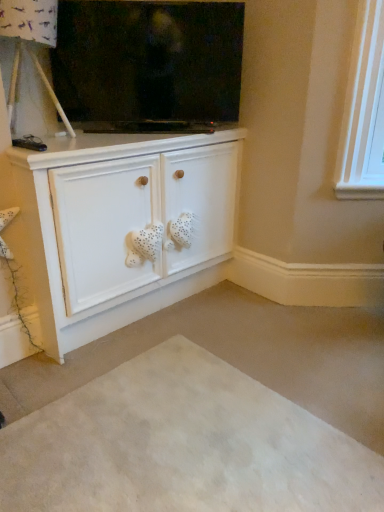
I want to click on flat screen tv at upper center, so click(148, 60).

This screenshot has width=384, height=512. In order to click on beige carpet at lower center in this screenshot , I will do `click(182, 445)`.

Which object is more forward, flat screen tv at upper center or beige carpet at lower center?

beige carpet at lower center is more forward.

Measure the distance between flat screen tv at upper center and beige carpet at lower center.

flat screen tv at upper center is 1.54 meters away from beige carpet at lower center.

Looking at this image, does flat screen tv at upper center have a lesser height compared to beige carpet at lower center?

A: Incorrect, the height of flat screen tv at upper center does not fall short of that of beige carpet at lower center.

In the scene shown: From the image's perspective, would you say flat screen tv at upper center is shown under beige carpet at lower center?

Actually, flat screen tv at upper center appears above beige carpet at lower center in the image.

Can you confirm if flat screen tv at upper center is wider than white matte cabinet at center?

In fact, flat screen tv at upper center might be narrower than white matte cabinet at center.

From the image's perspective, who appears lower, flat screen tv at upper center or white matte cabinet at center?

white matte cabinet at center.

Is flat screen tv at upper center positioned far away from white matte cabinet at center?

No.

From a real-world perspective, who is located lower, white matte cabinet at center or flat screen tv at upper center?

white matte cabinet at center.

Does white matte cabinet at center have a lesser width compared to flat screen tv at upper center?

No, white matte cabinet at center is not thinner than flat screen tv at upper center.

Is white matte cabinet at center oriented towards flat screen tv at upper center?

No, white matte cabinet at center is not facing towards flat screen tv at upper center.

Considering their positions, is white matte cabinet at center located in front of or behind flat screen tv at upper center?

Visually, white matte cabinet at center is located in front of flat screen tv at upper center.

Can we say beige carpet at lower center lies outside white matte cabinet at center?

Indeed, beige carpet at lower center is completely outside white matte cabinet at center.

Considering the relative positions of beige carpet at lower center and white matte cabinet at center in the image provided, is beige carpet at lower center to the left of white matte cabinet at center from the viewer's perspective?

No, beige carpet at lower center is not to the left of white matte cabinet at center.

Are beige carpet at lower center and white matte cabinet at center far apart?

No.

How different are the orientations of beige carpet at lower center and white matte cabinet at center in degrees?

The angular difference between beige carpet at lower center and white matte cabinet at center is 90.7 degrees.

Considering the relative positions of white matte cabinet at center and beige carpet at lower center in the image provided, is white matte cabinet at center to the left or to the right of beige carpet at lower center?

white matte cabinet at center is positioned on beige carpet at lower center's left side.

The width and height of the screenshot is (384, 512). Find the location of `plain lying on the right of white matte cabinet at center`. plain lying on the right of white matte cabinet at center is located at coordinates (182, 445).

Does white matte cabinet at center lie in front of beige carpet at lower center?

No, it is not.

From a real-world perspective, is white matte cabinet at center below beige carpet at lower center?

No, from a real-world perspective, white matte cabinet at center is not under beige carpet at lower center.

Would you say beige carpet at lower center is a long distance from flat screen tv at upper center?

Yes, beige carpet at lower center and flat screen tv at upper center are quite far apart.

Is point (237, 476) closer to camera compared to point (156, 46)?

Yes, point (237, 476) is in front of point (156, 46).

From their relative heights in the image, would you say beige carpet at lower center is taller or shorter than flat screen tv at upper center?

beige carpet at lower center is shorter than flat screen tv at upper center.

Do you think beige carpet at lower center is within flat screen tv at upper center, or outside of it?

beige carpet at lower center is not inside flat screen tv at upper center, it's outside.

In the image, there is a flat screen tv at upper center. Where is `plain below it (from a real-world perspective)`? The width and height of the screenshot is (384, 512). plain below it (from a real-world perspective) is located at coordinates (182, 445).

At what (x,y) coordinates should I click in order to perform the action: click on fireplace located on the right of white matte cabinet at center. Please return your answer as a coordinate pair (x, y). The image size is (384, 512). Looking at the image, I should click on (148, 60).

When comparing their distances from beige carpet at lower center, does white matte cabinet at center or flat screen tv at upper center seem closer?

white matte cabinet at center lies closer to beige carpet at lower center than the other object.

Estimate the real-world distances between objects in this image. Which object is closer to white matte cabinet at center, beige carpet at lower center or flat screen tv at upper center?

flat screen tv at upper center is closer to white matte cabinet at center.

Estimate the real-world distances between objects in this image. Which object is closer to flat screen tv at upper center, beige carpet at lower center or white matte cabinet at center?

white matte cabinet at center is positioned closer to the anchor flat screen tv at upper center.

Estimate the real-world distances between objects in this image. Which object is further from flat screen tv at upper center, white matte cabinet at center or beige carpet at lower center?

beige carpet at lower center.

When comparing their distances from white matte cabinet at center, does flat screen tv at upper center or beige carpet at lower center seem closer?

flat screen tv at upper center is positioned closer to the anchor white matte cabinet at center.

Looking at this image, which object lies nearer to the anchor point beige carpet at lower center, flat screen tv at upper center or white matte cabinet at center?

white matte cabinet at center.

This screenshot has height=512, width=384. I want to click on cabinetry between flat screen tv at upper center and beige carpet at lower center in the up-down direction, so click(x=120, y=226).